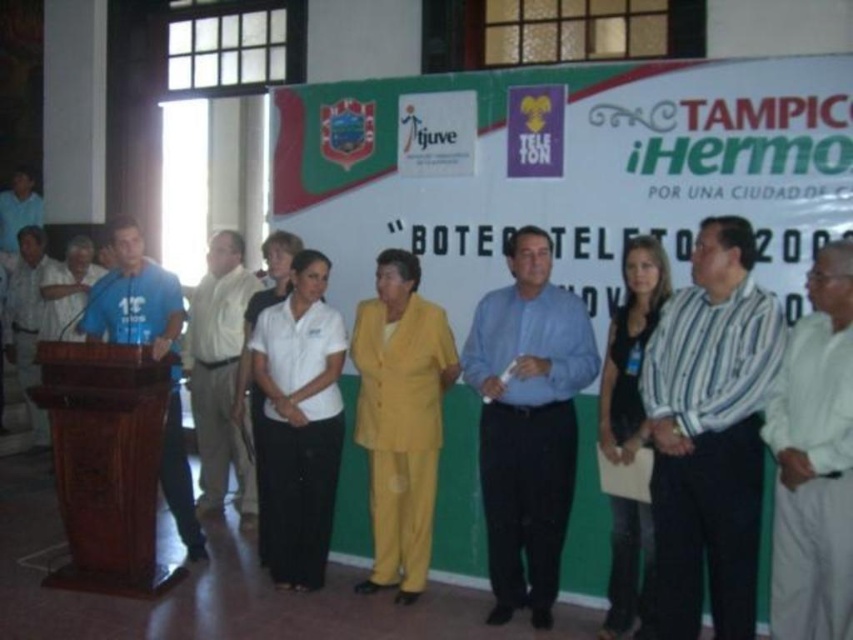
Question: Does blue shirt at center lie in front of striped fabric shirt at right?

Choices:
 (A) yes
 (B) no

Answer: (B)

Question: Does striped fabric shirt at right have a greater width compared to yellow fabric suit at center?

Choices:
 (A) yes
 (B) no

Answer: (B)

Question: Does striped cotton shirt at right have a greater width compared to striped fabric shirt at right?

Choices:
 (A) yes
 (B) no

Answer: (A)

Question: Which object is positioned closest to the blue t-shirt at left?

Choices:
 (A) striped cotton shirt at right
 (B) yellow fabric suit at center

Answer: (B)

Question: Which point is farther to the camera?

Choices:
 (A) yellow fabric suit at center
 (B) blue shirt at left

Answer: (B)

Question: Based on their relative distances, which object is nearer to the striped cotton shirt at right?

Choices:
 (A) blue shirt at left
 (B) blue t-shirt at left
 (C) brown polished wood podium at left
 (D) white smooth shirt at center

Answer: (D)